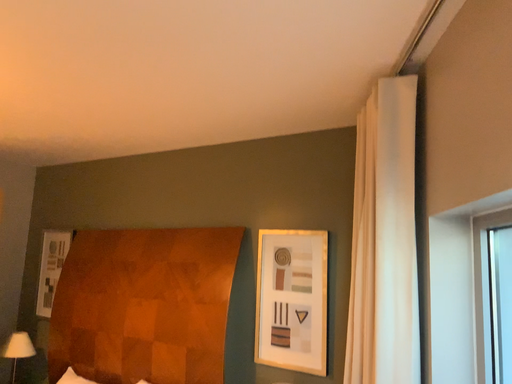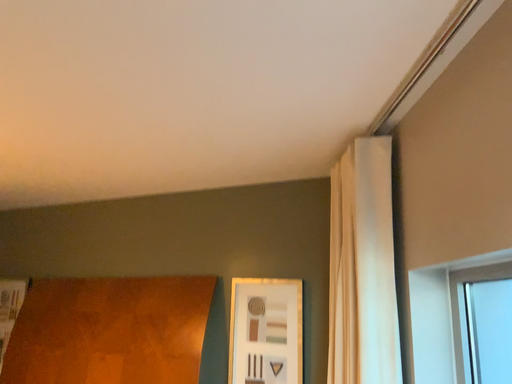
Question: How did the camera likely rotate when shooting the video?

Choices:
 (A) rotated right
 (B) rotated left

Answer: (A)